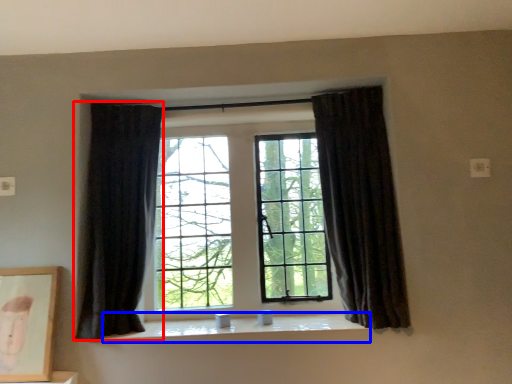
Question: Among these objects, which one is nearest to the camera, curtain (highlighted by a red box) or window sill (highlighted by a blue box)?

Choices:
 (A) curtain
 (B) window sill

Answer: (A)